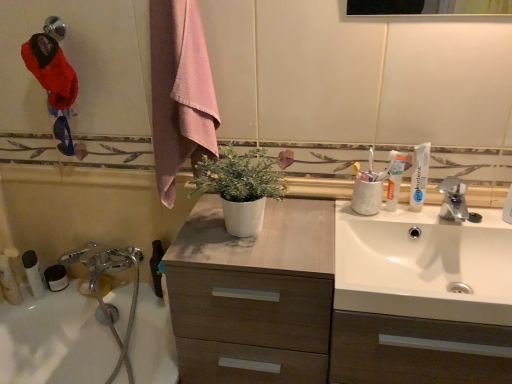
Describe the element at coordinates (395, 180) in the screenshot. I see `white matte toothpaste at upper right, the second toothpaste viewed from the right` at that location.

I want to click on pink cotton towel at upper center, so [180, 92].

The image size is (512, 384). Identify the location of white plastic tube at lower left, the second toiletry viewed from the right. (15, 263).

Describe the element at coordinates (455, 201) in the screenshot. I see `silver metallic faucet at upper right` at that location.

Where is `white matte toothpaste at upper right, which is the third toothpaste in right-to-left order`? The image size is (512, 384). white matte toothpaste at upper right, which is the third toothpaste in right-to-left order is located at coordinates (387, 167).

The width and height of the screenshot is (512, 384). I want to click on white matte toothpaste at upper right, the second toothpaste viewed from the left, so click(395, 180).

Can you tell me how much wooden cabinet at center and white glossy sink at center right differ in facing direction?

The angular difference between wooden cabinet at center and white glossy sink at center right is 0.000495 degrees.

Is wooden cabinet at center not within white glossy sink at center right?

Indeed, wooden cabinet at center is completely outside white glossy sink at center right.

From a real-world perspective, is wooden cabinet at center physically located above or below white glossy sink at center right?

From a real-world perspective, wooden cabinet at center is physically below white glossy sink at center right.

Does wooden cabinet at center have a lesser width compared to white glossy sink at center right?

Correct, the width of wooden cabinet at center is less than that of white glossy sink at center right.

Identify the location of sink that appears on the right of white matte pot at center. The width and height of the screenshot is (512, 384). (424, 265).

Considering the sizes of white glossy sink at center right and white matte pot at center in the image, is white glossy sink at center right wider or thinner than white matte pot at center?

white glossy sink at center right is wider than white matte pot at center.

Consider the image. Is white matte pot at center completely or partially inside white glossy sink at center right?

That's incorrect, white matte pot at center is not inside white glossy sink at center right.

Which is in front, white glossy sink at center right or white matte pot at center?

white glossy sink at center right.

Is white plastic tube at lower left, arranged as the 2th toiletry when viewed from the left, oriented towards white matte tube of toothpaste at upper right, positioned as the third toothpaste in left-to-right order?

No, white plastic tube at lower left, arranged as the 2th toiletry when viewed from the left, is not oriented towards white matte tube of toothpaste at upper right, positioned as the third toothpaste in left-to-right order.

Can we say white plastic tube at lower left, the second toiletry viewed from the right, lies outside white matte tube of toothpaste at upper right, the first toothpaste when ordered from right to left?

Yes, white plastic tube at lower left, the second toiletry viewed from the right, is not within white matte tube of toothpaste at upper right, the first toothpaste when ordered from right to left.

Can you confirm if white plastic tube at lower left, arranged as the 2th toiletry when viewed from the left, is smaller than white matte tube of toothpaste at upper right, positioned as the third toothpaste in left-to-right order?

Indeed, white plastic tube at lower left, arranged as the 2th toiletry when viewed from the left, has a smaller size compared to white matte tube of toothpaste at upper right, positioned as the third toothpaste in left-to-right order.

Can you confirm if white plastic tube at lower left, the second toiletry viewed from the right, is taller than white matte tube of toothpaste at upper right, the first toothpaste when ordered from right to left?

No, white plastic tube at lower left, the second toiletry viewed from the right, is not taller than white matte tube of toothpaste at upper right, the first toothpaste when ordered from right to left.

Is white plastic tube at lower left, which appears as the 1th toiletry when viewed from the left, completely or partially outside of white plastic tube at lower left, the second toiletry viewed from the right?

Yes.

Which is closer, (3, 279) or (16, 257)?

The point (3, 279) is more forward.

Consider the image. Is the position of white plastic tube at lower left, placed as the third toiletry when sorted from right to left, more distant than that of white plastic tube at lower left, the second toiletry viewed from the right?

No, it is not.

What's the angular difference between white plastic tube at lower left, placed as the third toiletry when sorted from right to left, and white plastic tube at lower left, arranged as the 2th toiletry when viewed from the left,'s facing directions?

There is a 3.44-degree angle between the facing directions of white plastic tube at lower left, placed as the third toiletry when sorted from right to left, and white plastic tube at lower left, arranged as the 2th toiletry when viewed from the left.

How many degrees apart are the facing directions of white matte tube of toothpaste at upper right, the first toothpaste when ordered from right to left, and white matte toothpaste at upper right, the second toothpaste viewed from the left?

white matte tube of toothpaste at upper right, the first toothpaste when ordered from right to left, and white matte toothpaste at upper right, the second toothpaste viewed from the left, are facing 0.00347 degrees away from each other.

The height and width of the screenshot is (384, 512). What are the coordinates of `toothpaste lying below the white matte tube of toothpaste at upper right, positioned as the third toothpaste in left-to-right order (from the image's perspective)` in the screenshot? It's located at (395, 180).

Is white matte toothpaste at upper right, the second toothpaste viewed from the right, at the back of white matte tube of toothpaste at upper right, the first toothpaste when ordered from right to left?

white matte tube of toothpaste at upper right, the first toothpaste when ordered from right to left, does not have its back to white matte toothpaste at upper right, the second toothpaste viewed from the right.

Identify the location of sink located above the wooden cabinet at center (from the image's perspective). (424, 265).

Is white glossy sink at center right behind wooden cabinet at center?

Yes.

Does white glossy sink at center right have a larger size compared to wooden cabinet at center?

No, white glossy sink at center right is not bigger than wooden cabinet at center.

Is point (466, 232) positioned before point (179, 360)?

Yes, it is.

How different are the orientations of white matte toothpaste at upper right, which is the third toothpaste in right-to-left order, and silver metallic faucet at upper right in degrees?

white matte toothpaste at upper right, which is the third toothpaste in right-to-left order, and silver metallic faucet at upper right are facing 0.000486 degrees away from each other.

Can you confirm if white matte toothpaste at upper right, which is the third toothpaste in right-to-left order, is smaller than silver metallic faucet at upper right?

Correct, white matte toothpaste at upper right, which is the third toothpaste in right-to-left order, occupies less space than silver metallic faucet at upper right.

Considering the positions of objects white matte toothpaste at upper right, the first toothpaste from the left, and silver metallic faucet at upper right in the image provided, who is more to the left, white matte toothpaste at upper right, the first toothpaste from the left, or silver metallic faucet at upper right?

white matte toothpaste at upper right, the first toothpaste from the left, is more to the left.

The width and height of the screenshot is (512, 384). I want to click on sink positioned vertically above the wooden cabinet at center (from a real-world perspective), so coord(424,265).

At what (x,y) coordinates should I click in order to perform the action: click on sink on the right of white matte pot at center. Please return your answer as a coordinate pair (x, y). Looking at the image, I should click on (424, 265).

Which object lies further to the anchor point white matte pot at center, wooden cabinet at center or white plastic tube at left, the 3th toiletry viewed from the left?

white plastic tube at left, the 3th toiletry viewed from the left, is positioned further to the anchor white matte pot at center.

Based on their spatial positions, is white plastic tube at left, the 3th toiletry viewed from the left, or wooden cabinet at center further from white glossy bathtub at lower left?

Among the two, wooden cabinet at center is located further to white glossy bathtub at lower left.

From the image, which object appears to be farther from white plastic tube at left, the 3th toiletry viewed from the left, white matte toothpaste at upper right, the second toothpaste viewed from the right, or pink cotton towel at upper center?

Based on the image, white matte toothpaste at upper right, the second toothpaste viewed from the right, appears to be further to white plastic tube at left, the 3th toiletry viewed from the left.

Considering their positions, is white matte tube of toothpaste at upper right, the first toothpaste when ordered from right to left, positioned further to white plastic tube at lower left, placed as the third toiletry when sorted from right to left, than pink cotton towel at upper center?

white matte tube of toothpaste at upper right, the first toothpaste when ordered from right to left, is further to white plastic tube at lower left, placed as the third toiletry when sorted from right to left.

Based on their spatial positions, is white plastic tube at lower left, arranged as the 2th toiletry when viewed from the left, or white glossy sink at center right further from silver metallic faucet at upper right?

Based on the image, white plastic tube at lower left, arranged as the 2th toiletry when viewed from the left, appears to be further to silver metallic faucet at upper right.

Looking at the image, which one is located further to white matte tube of toothpaste at upper right, the first toothpaste when ordered from right to left, white matte pot at center or white glossy sink at center right?

Among the two, white matte pot at center is located further to white matte tube of toothpaste at upper right, the first toothpaste when ordered from right to left.

Based on their spatial positions, is silver metallic faucet at upper right or wooden cabinet at center further from white glossy bathtub at lower left?

silver metallic faucet at upper right.

Which object lies nearer to the anchor point white matte pot at center, white matte toothpaste at upper right, the first toothpaste from the left, or white plastic tube at lower left, placed as the third toiletry when sorted from right to left?

Among the two, white matte toothpaste at upper right, the first toothpaste from the left, is located nearer to white matte pot at center.

Identify the location of bath between white plastic tube at left, placed as the first toiletry when sorted from right to left, and wooden cabinet at center, in the horizontal direction. This screenshot has width=512, height=384. (55, 340).

This screenshot has width=512, height=384. I want to click on tap located between white glossy sink at center right and white matte toothpaste at upper right, which is the third toothpaste in right-to-left order, in the depth direction, so click(455, 201).

Locate an element on the screen. Image resolution: width=512 pixels, height=384 pixels. houseplant that lies between pink cotton towel at upper center and wooden cabinet at center from top to bottom is located at coordinates (241, 187).

The width and height of the screenshot is (512, 384). What are the coordinates of `bath towel located between white plastic tube at lower left, placed as the third toiletry when sorted from right to left, and white matte pot at center in the left-right direction` in the screenshot? It's located at (180, 92).